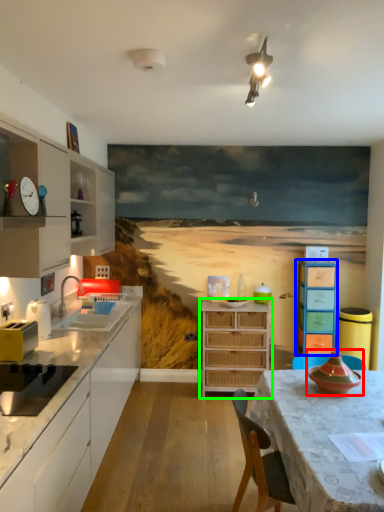
Question: Considering the real-world distances, which object is farthest from appliance (highlighted by a red box)? chest of drawers (highlighted by a blue box) or chest of drawers (highlighted by a green box)?

Choices:
 (A) chest of drawers
 (B) chest of drawers

Answer: (B)